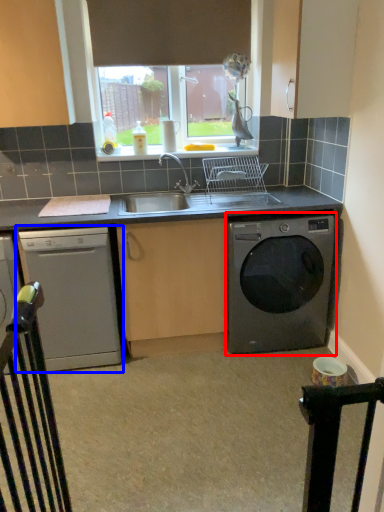
Question: Which of the following is the farthest to the observer, washing machine (highlighted by a red box) or dishwasher (highlighted by a blue box)?

Choices:
 (A) washing machine
 (B) dishwasher

Answer: (A)